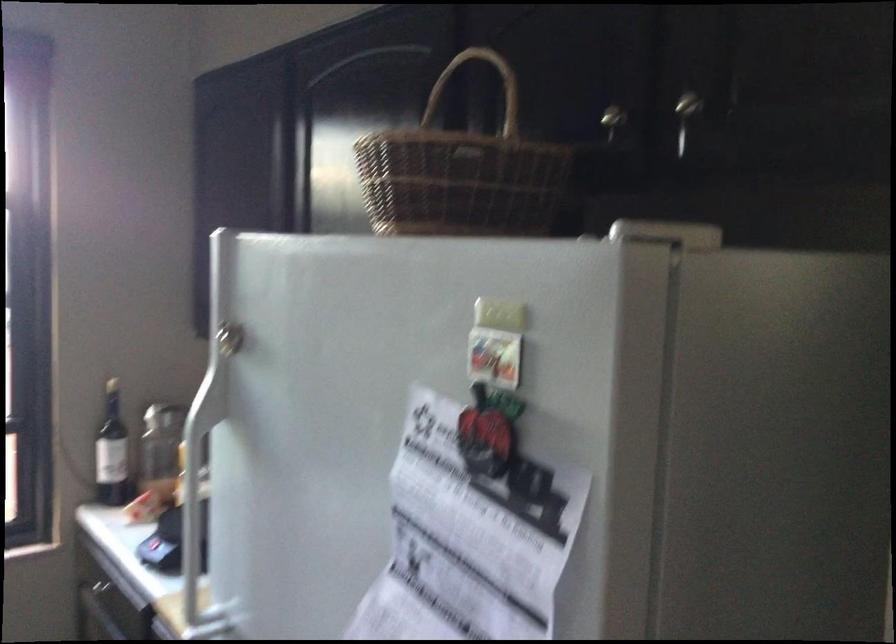
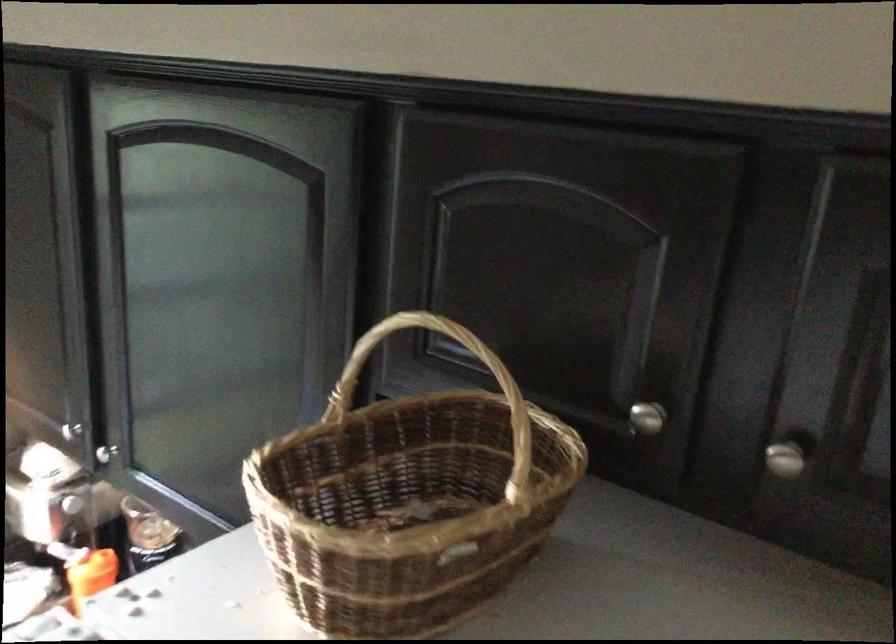
Question: What movement of the cameraman would produce the second image?

Choices:
 (A) Left
 (B) Right
 (C) Forward
 (D) Backward

Answer: (C)